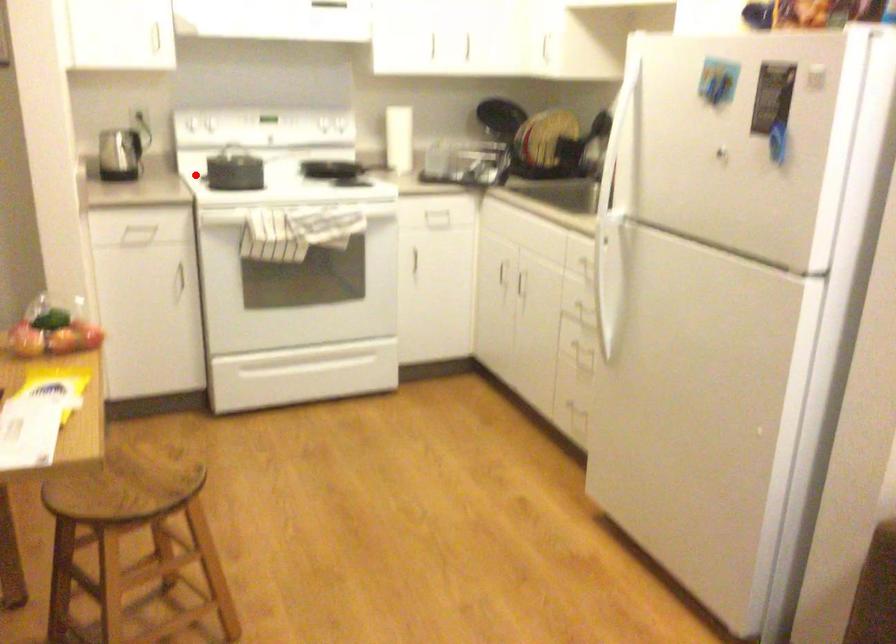
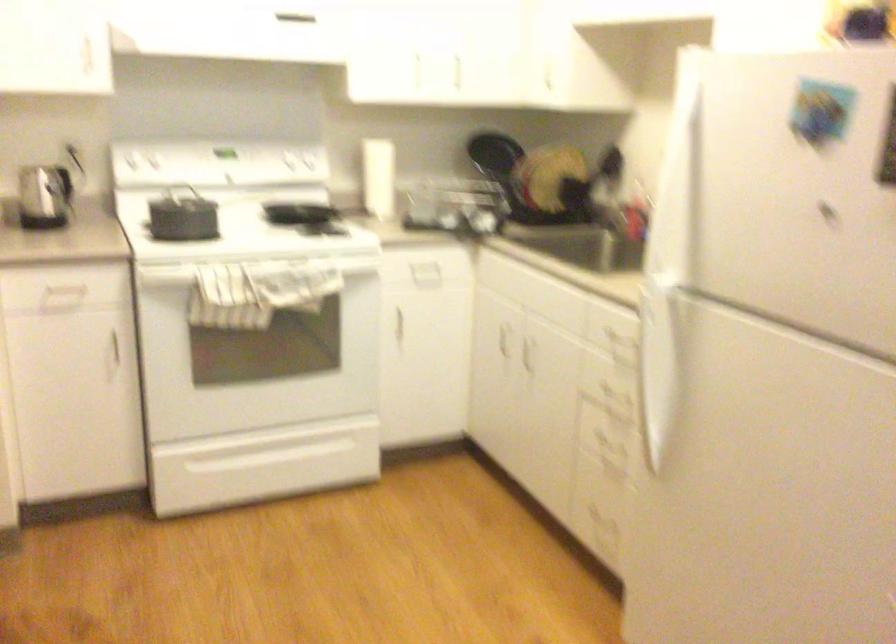
Question: I am providing you with two images of the same scene from different viewpoints. In image1, a red point is highlighted. Considering the same 3D point in image2, which of the following is correct?

Choices:
 (A) It is closer
 (B) It is farther

Answer: (A)